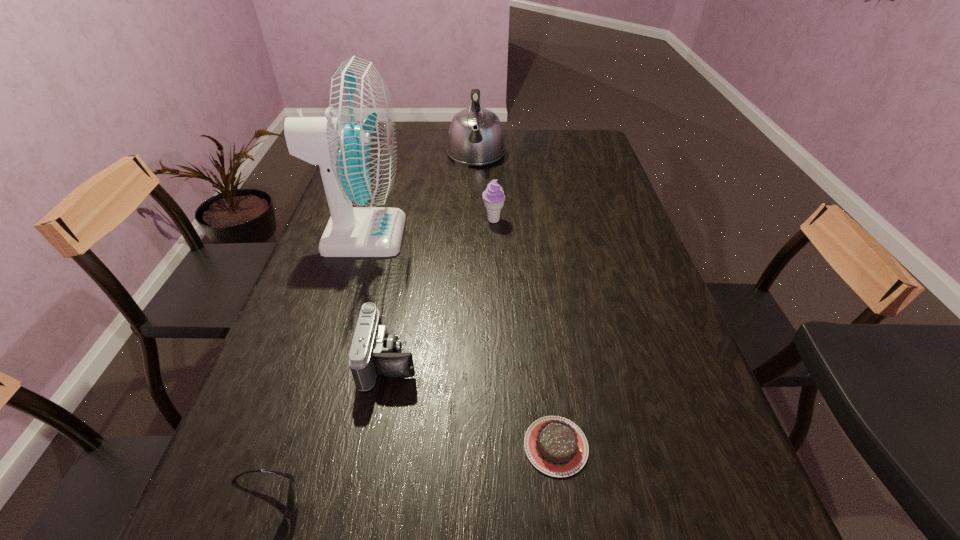
Identify the location of vacant space that satisfies the following two spatial constraints: 1. in front of the tallest object to face the airflow; 2. on the left side of the chocolate cake. (296, 446).

Find the location of `vacant region that satisfies the following two spatial constraints: 1. at the front of the fourth tallest object with an open lens cover; 2. on the right side of the chocolate cake`. vacant region that satisfies the following two spatial constraints: 1. at the front of the fourth tallest object with an open lens cover; 2. on the right side of the chocolate cake is located at coordinates (374, 446).

The width and height of the screenshot is (960, 540). Identify the location of free spot that satisfies the following two spatial constraints: 1. at the front of the shortest object with an open lens cover; 2. on the left side of the fourth farthest object. (374, 446).

Image resolution: width=960 pixels, height=540 pixels. I want to click on free location that satisfies the following two spatial constraints: 1. in front of the tallest object to face the airflow; 2. on the back side of the shortest object, so click(x=296, y=446).

Image resolution: width=960 pixels, height=540 pixels. Identify the location of free spot that satisfies the following two spatial constraints: 1. on the back side of the chocolate cake; 2. at the front of the third shortest object with an open lens cover. (544, 360).